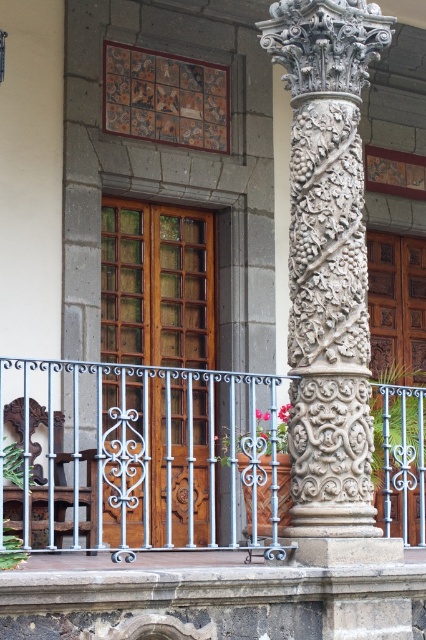
Question: Which point is closer to the camera?

Choices:
 (A) (100, 509)
 (B) (325, 140)

Answer: (A)

Question: Is white wrought iron balustrade at center below white stone column at center?

Choices:
 (A) yes
 (B) no

Answer: (A)

Question: Is white wrought iron balustrade at center positioned at the back of white stone column at center?

Choices:
 (A) yes
 (B) no

Answer: (B)

Question: Which point is closer to the camera?

Choices:
 (A) (250, 380)
 (B) (336, 289)

Answer: (A)

Question: Does white wrought iron balustrade at center have a larger size compared to white stone column at center?

Choices:
 (A) yes
 (B) no

Answer: (A)

Question: Which point appears closest to the camera in this image?

Choices:
 (A) (213, 387)
 (B) (327, 253)

Answer: (A)